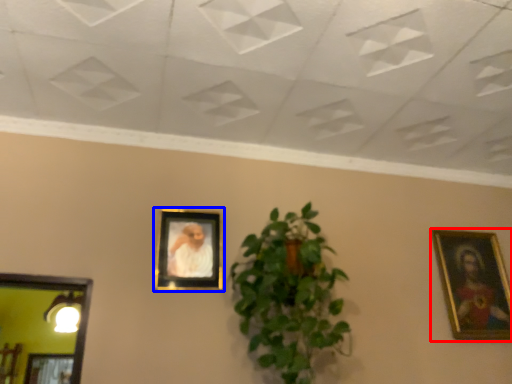
Question: Which point is further to the camera, picture frame (highlighted by a red box) or picture frame (highlighted by a blue box)?

Choices:
 (A) picture frame
 (B) picture frame

Answer: (A)